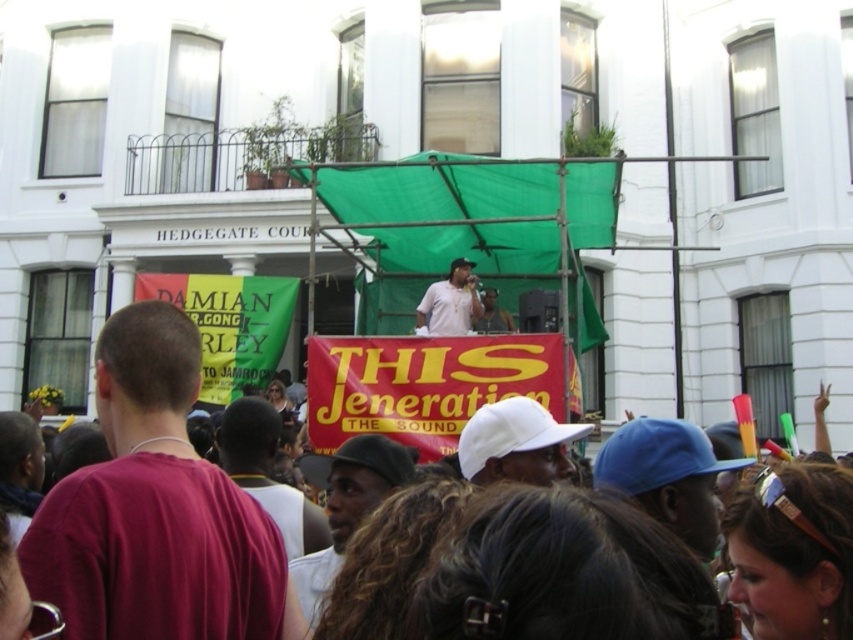
Is white matte baseball cap at center to the left of dark brown leather jacket at center from the viewer's perspective?

In fact, white matte baseball cap at center is to the right of dark brown leather jacket at center.

Is white matte baseball cap at center bigger than dark brown leather jacket at center?

No, white matte baseball cap at center is not bigger than dark brown leather jacket at center.

The width and height of the screenshot is (853, 640). Describe the element at coordinates (515, 444) in the screenshot. I see `white matte baseball cap at center` at that location.

The height and width of the screenshot is (640, 853). In order to click on white matte baseball cap at center in this screenshot , I will do `click(515, 444)`.

Is white matte baseball cap at center to the left of white matte shirt at center from the viewer's perspective?

Incorrect, white matte baseball cap at center is not on the left side of white matte shirt at center.

Is white matte baseball cap at center smaller than white matte shirt at center?

Yes, white matte baseball cap at center is smaller than white matte shirt at center.

Identify the location of white matte baseball cap at center. The image size is (853, 640). (515, 444).

Who is shorter, blue matte baseball cap at center or matte white shirt at center?

Standing shorter between the two is matte white shirt at center.

Which is below, blue matte baseball cap at center or matte white shirt at center?

Positioned lower is blue matte baseball cap at center.

This screenshot has height=640, width=853. In order to click on blue matte baseball cap at center in this screenshot , I will do click(x=666, y=476).

Find the location of a particular element. blue matte baseball cap at center is located at coordinates (666, 476).